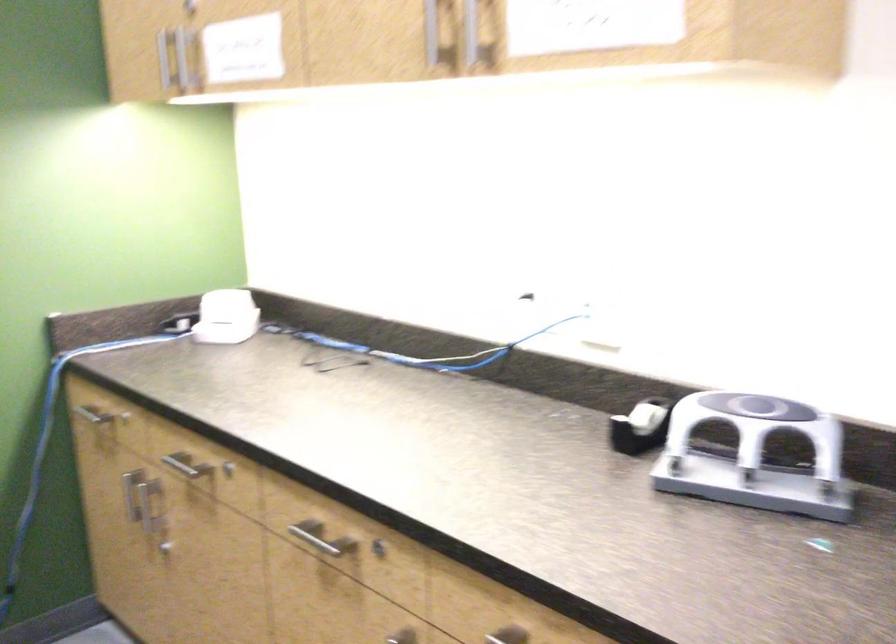
This screenshot has height=644, width=896. What do you see at coordinates (755, 456) in the screenshot? I see `the hole puncher lever` at bounding box center [755, 456].